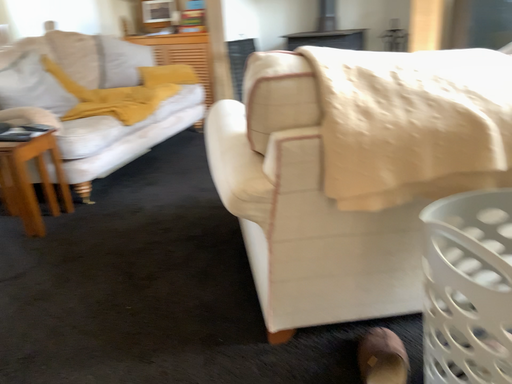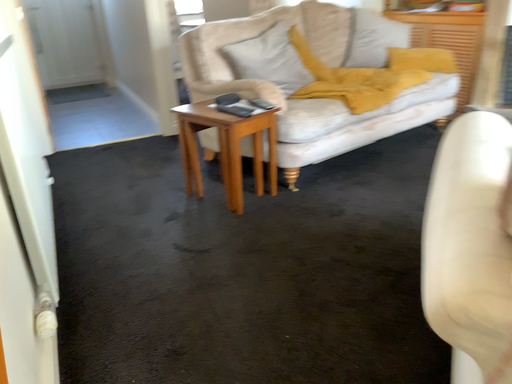
Question: How did the camera likely rotate when shooting the video?

Choices:
 (A) rotated right
 (B) rotated left

Answer: (B)